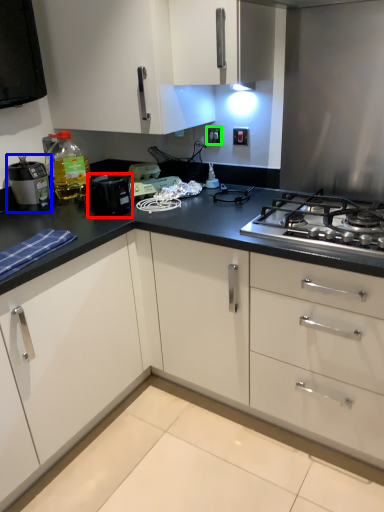
Question: Based on their relative distances, which object is nearer to kitchen appliance (highlighted by a red box)? Choose from kitchen appliance (highlighted by a blue box) and electric outlet (highlighted by a green box).

Choices:
 (A) kitchen appliance
 (B) electric outlet

Answer: (A)